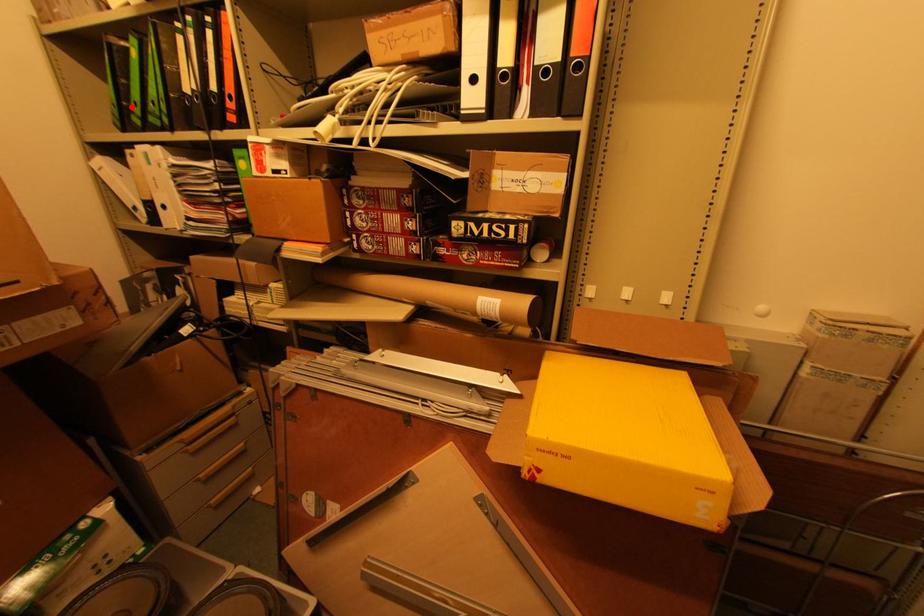
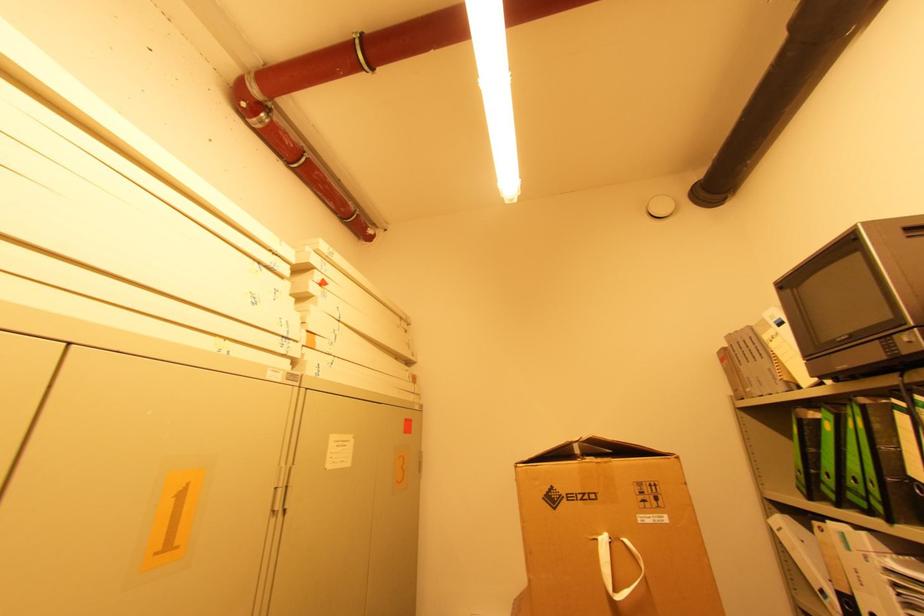
Where in the second image is the point corresponding to the highlighted location from the first image?

(822, 476)